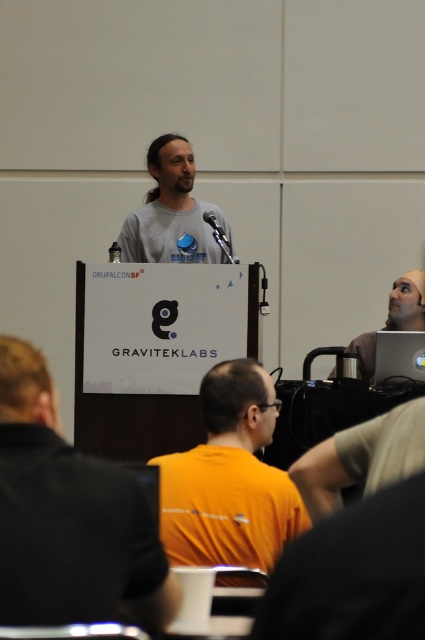
Question: Can you confirm if matte black laptop at upper right is positioned to the right of black plastic laptop at lower right?

Choices:
 (A) yes
 (B) no

Answer: (A)

Question: Is orange matte shirt at center thinner than gray matte shirt at center?

Choices:
 (A) yes
 (B) no

Answer: (A)

Question: Considering the real-world distances, which object is farthest from the gray matte shirt at center?

Choices:
 (A) orange matte shirt at center
 (B) black matte shirt at left
 (C) black plastic laptop at lower right

Answer: (B)

Question: Which point is farther to the camera?

Choices:
 (A) (387, 346)
 (B) (155, 596)

Answer: (A)

Question: Which object appears farthest from the camera in this image?

Choices:
 (A) black plastic laptop at lower right
 (B) black matte shirt at left

Answer: (A)

Question: Is matte black laptop at upper right to the right of black plastic laptop at lower right from the viewer's perspective?

Choices:
 (A) yes
 (B) no

Answer: (A)